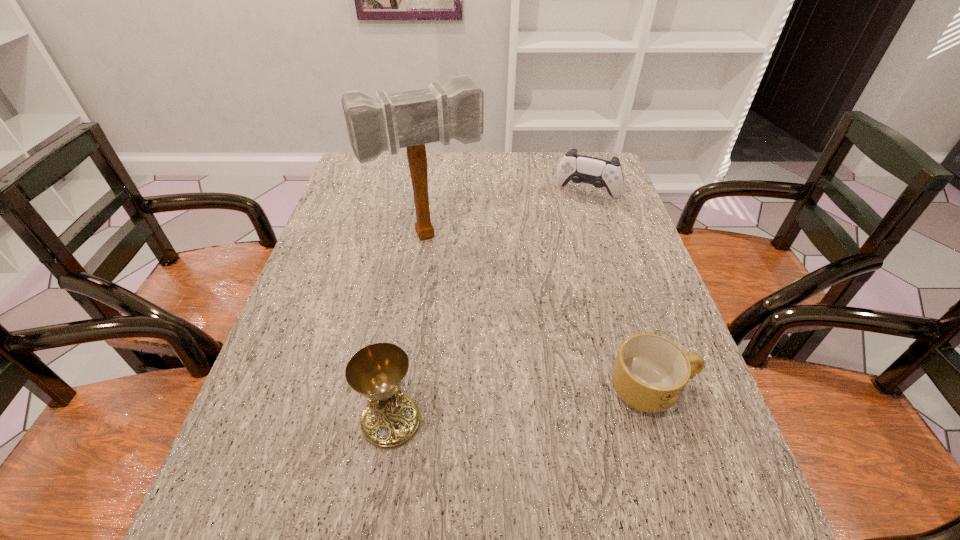
What are the coordinates of `vacant space at the left edge of the desktop` in the screenshot? It's located at (309, 305).

This screenshot has height=540, width=960. In the image, there is a desktop. Identify the location of free space at the right edge. (632, 227).

Where is `free space that is in between the mug and the second tallest object`? free space that is in between the mug and the second tallest object is located at coordinates (522, 406).

Identify the location of free area in between the control and the shortest object. (620, 292).

Locate an element on the screen. This screenshot has height=540, width=960. free space between the farthest object and the third nearest object is located at coordinates (508, 214).

Locate an element on the screen. The width and height of the screenshot is (960, 540). free space between the tallest object and the mug is located at coordinates [540, 313].

Identify the location of vacant area between the second shortest object and the second tallest object. (490, 307).

In order to click on free point between the farthest object and the shortest object in this screenshot , I will do `click(620, 292)`.

Find the location of a particular element. This screenshot has height=540, width=960. empty space that is in between the chalice and the tallest object is located at coordinates (410, 329).

Where is `vacant space that's between the mallet and the chalice`? The width and height of the screenshot is (960, 540). vacant space that's between the mallet and the chalice is located at coordinates (410, 329).